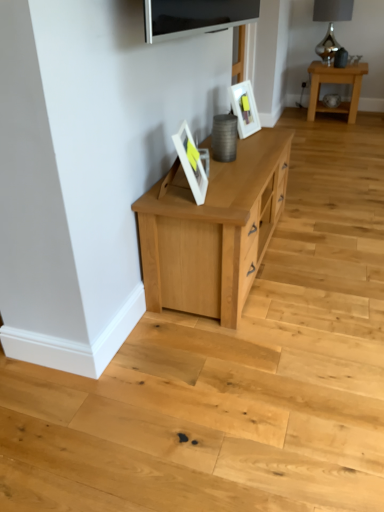
Describe the element at coordinates (331, 24) in the screenshot. The image size is (384, 512). I see `satin silver lamp at upper right` at that location.

Image resolution: width=384 pixels, height=512 pixels. What do you see at coordinates (195, 17) in the screenshot?
I see `flat-screen tv at upper center` at bounding box center [195, 17].

What do you see at coordinates (191, 163) in the screenshot?
I see `matte white picture frame at center, the first picture frame positioned from the bottom` at bounding box center [191, 163].

Image resolution: width=384 pixels, height=512 pixels. I want to click on satin silver lamp at upper right, so click(x=331, y=24).

How far apart are light oak table at upper right and satin silver lamp at upper right?

The distance of light oak table at upper right from satin silver lamp at upper right is 21.96 inches.

Does light oak table at upper right have a greater height compared to satin silver lamp at upper right?

No, light oak table at upper right is not taller than satin silver lamp at upper right.

Is light oak table at upper right far from satin silver lamp at upper right?

No, light oak table at upper right is in close proximity to satin silver lamp at upper right.

How different are the orientations of light oak table at upper right and satin silver lamp at upper right in degrees?

The facing directions of light oak table at upper right and satin silver lamp at upper right are 42.4 degrees apart.

Choose the correct answer: Is white glossy picture frame at upper center, the second picture frame in the left-to-right sequence, inside satin silver lamp at upper right or outside it?

white glossy picture frame at upper center, the second picture frame in the left-to-right sequence, is spatially situated outside satin silver lamp at upper right.

Considering the positions of objects white glossy picture frame at upper center, which appears as the 2th picture frame when viewed from the front, and satin silver lamp at upper right in the image provided, who is more to the right, white glossy picture frame at upper center, which appears as the 2th picture frame when viewed from the front, or satin silver lamp at upper right?

From the viewer's perspective, satin silver lamp at upper right appears more on the right side.

Can you tell me how much white glossy picture frame at upper center, the second picture frame in the left-to-right sequence, and satin silver lamp at upper right differ in facing direction?

The facing directions of white glossy picture frame at upper center, the second picture frame in the left-to-right sequence, and satin silver lamp at upper right are 29.5 degrees apart.

Considering the relative sizes of white glossy picture frame at upper center, positioned as the first picture frame in top-to-bottom order, and satin silver lamp at upper right in the image provided, is white glossy picture frame at upper center, positioned as the first picture frame in top-to-bottom order, bigger than satin silver lamp at upper right?

Actually, white glossy picture frame at upper center, positioned as the first picture frame in top-to-bottom order, might be smaller than satin silver lamp at upper right.

Does point (344, 18) come behind point (173, 17)?

Yes, it is.

From a real-world perspective, which object stands above the other?

flat-screen tv at upper center is physically above.

Is satin silver lamp at upper right placed right next to flat-screen tv at upper center?

No.

Between satin silver lamp at upper right and flat-screen tv at upper center, which one has smaller size?

flat-screen tv at upper center.

Is flat-screen tv at upper center in contact with matte white picture frame at center, the first picture frame positioned from the bottom?

No, flat-screen tv at upper center is not with matte white picture frame at center, the first picture frame positioned from the bottom.

Which object is positioned more to the right, flat-screen tv at upper center or matte white picture frame at center, the 1th picture frame viewed from the left?

Positioned to the right is flat-screen tv at upper center.

Is flat-screen tv at upper center facing towards matte white picture frame at center, acting as the 2th picture frame starting from the top?

No, flat-screen tv at upper center is not aimed at matte white picture frame at center, acting as the 2th picture frame starting from the top.

Between white glossy picture frame at upper center, the 1th picture frame viewed from the back, and flat-screen tv at upper center, which one appears on the right side from the viewer's perspective?

white glossy picture frame at upper center, the 1th picture frame viewed from the back.

How far apart are white glossy picture frame at upper center, the 2th picture frame positioned from the bottom, and flat-screen tv at upper center?

The distance of white glossy picture frame at upper center, the 2th picture frame positioned from the bottom, from flat-screen tv at upper center is 31.58 inches.

Is white glossy picture frame at upper center, the 2th picture frame positioned from the bottom, touching flat-screen tv at upper center?

white glossy picture frame at upper center, the 2th picture frame positioned from the bottom, and flat-screen tv at upper center are clearly separated.

Can you tell me how much white glossy picture frame at upper center, the 1th picture frame viewed from the back, and flat-screen tv at upper center differ in facing direction?

9.36 degrees separate the facing orientations of white glossy picture frame at upper center, the 1th picture frame viewed from the back, and flat-screen tv at upper center.

Where is `picture frame in front of the white glossy picture frame at upper center, the first picture frame when ordered from right to left`? picture frame in front of the white glossy picture frame at upper center, the first picture frame when ordered from right to left is located at coordinates (191, 163).

Is white glossy picture frame at upper center, the first picture frame when ordered from right to left, located within matte white picture frame at center, positioned as the 2th picture frame in right-to-left order?

No, white glossy picture frame at upper center, the first picture frame when ordered from right to left, is not inside matte white picture frame at center, positioned as the 2th picture frame in right-to-left order.

Is matte white picture frame at center, the first picture frame positioned from the bottom, thinner than white glossy picture frame at upper center, positioned as the first picture frame in top-to-bottom order?

Yes.

Is point (184, 150) positioned before point (171, 19)?

No, it is not.

Does matte white picture frame at center, which is the second picture frame from back to front, appear on the right side of flat-screen tv at upper center?

In fact, matte white picture frame at center, which is the second picture frame from back to front, is to the left of flat-screen tv at upper center.

Looking at this image, how much distance is there between matte white picture frame at center, positioned as the 2th picture frame in right-to-left order, and flat-screen tv at upper center?

matte white picture frame at center, positioned as the 2th picture frame in right-to-left order, and flat-screen tv at upper center are 45.57 centimeters apart.

In the scene shown: From the image's perspective, relative to flat-screen tv at upper center, is matte white picture frame at center, the 1th picture frame viewed from the left, above or below?

Clearly, from the image's perspective, matte white picture frame at center, the 1th picture frame viewed from the left, is below flat-screen tv at upper center.

The width and height of the screenshot is (384, 512). What are the coordinates of `table on the right of satin silver lamp at upper right` in the screenshot? It's located at (335, 83).

In the image, there is a white glossy picture frame at upper center, which appears as the 2th picture frame when viewed from the front. Identify the location of lamp above it (from the image's perspective). (331, 24).

Estimate the real-world distances between objects in this image. Which object is further from white glossy picture frame at upper center, the 2th picture frame positioned from the bottom, light oak table at upper right or satin silver lamp at upper right?

satin silver lamp at upper right is positioned further to the anchor white glossy picture frame at upper center, the 2th picture frame positioned from the bottom.

Looking at the image, which one is located further to white glossy picture frame at upper center, the 2th picture frame positioned from the bottom, light oak table at upper right or flat-screen tv at upper center?

light oak table at upper right is further to white glossy picture frame at upper center, the 2th picture frame positioned from the bottom.

Considering their positions, is satin silver lamp at upper right positioned closer to matte white picture frame at center, the first picture frame positioned from the bottom, than flat-screen tv at upper center?

The object closer to matte white picture frame at center, the first picture frame positioned from the bottom, is flat-screen tv at upper center.

Looking at the image, which one is located closer to white glossy picture frame at upper center, the second picture frame in the left-to-right sequence, flat-screen tv at upper center or matte white picture frame at center, which is the second picture frame from back to front?

matte white picture frame at center, which is the second picture frame from back to front.

Estimate the real-world distances between objects in this image. Which object is further from satin silver lamp at upper right, white glossy picture frame at upper center, the 1th picture frame viewed from the back, or light oak table at upper right?

Based on the image, white glossy picture frame at upper center, the 1th picture frame viewed from the back, appears to be further to satin silver lamp at upper right.

Consider the image. When comparing their distances from flat-screen tv at upper center, does white glossy picture frame at upper center, which appears as the 2th picture frame when viewed from the front, or matte white picture frame at center, the 1th picture frame viewed from the left, seem further?

Among the two, white glossy picture frame at upper center, which appears as the 2th picture frame when viewed from the front, is located further to flat-screen tv at upper center.

Looking at the image, which one is located further to flat-screen tv at upper center, light oak table at upper right or matte white picture frame at center, which is the second picture frame from back to front?

light oak table at upper right.

Looking at this image, looking at the image, which one is located closer to white glossy picture frame at upper center, the 1th picture frame viewed from the back, flat-screen tv at upper center or light oak table at upper right?

flat-screen tv at upper center is positioned closer to the anchor white glossy picture frame at upper center, the 1th picture frame viewed from the back.

Identify the location of picture frame between flat-screen tv at upper center and white glossy picture frame at upper center, positioned as the first picture frame in top-to-bottom order, along the z-axis. The width and height of the screenshot is (384, 512). (191, 163).

At what (x,y) coordinates should I click in order to perform the action: click on picture frame between matte white picture frame at center, which is counted as the first picture frame, starting from the front, and satin silver lamp at upper right, along the z-axis. Please return your answer as a coordinate pair (x, y). Looking at the image, I should click on (244, 108).

Identify the location of lamp between matte white picture frame at center, acting as the 2th picture frame starting from the top, and light oak table at upper right from front to back. Image resolution: width=384 pixels, height=512 pixels. (331, 24).

Where is `picture frame between matte white picture frame at center, acting as the 2th picture frame starting from the top, and light oak table at upper right, along the z-axis`? picture frame between matte white picture frame at center, acting as the 2th picture frame starting from the top, and light oak table at upper right, along the z-axis is located at coordinates (244, 108).